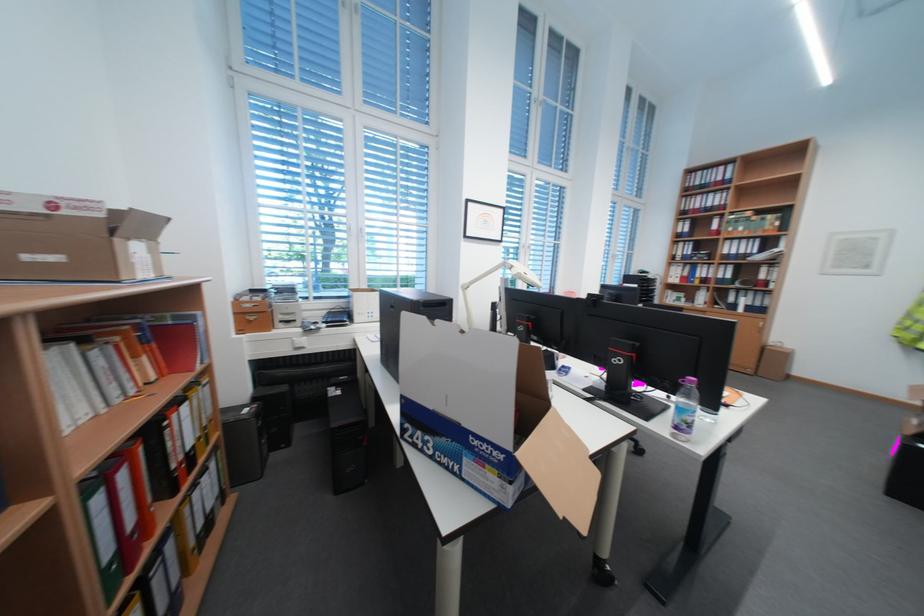
Find where to unscrew the plastic water bottle. Please return your answer as a coordinate pair (x, y).

(685, 408)